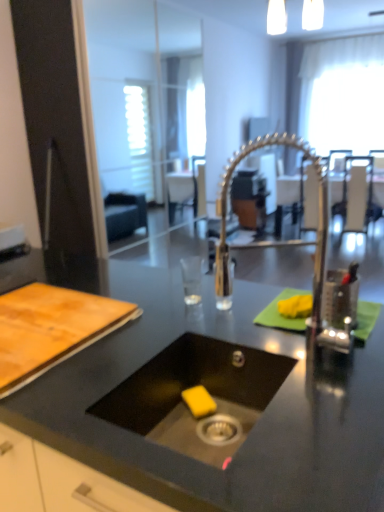
The width and height of the screenshot is (384, 512). What do you see at coordinates (253, 428) in the screenshot?
I see `black matte countertop at center` at bounding box center [253, 428].

Locate an element on the screen. The height and width of the screenshot is (512, 384). wooden cutting board at left is located at coordinates (51, 329).

What are the coordinates of `metallic silver chair at upper right, the 1th chair viewed from the right` in the screenshot? It's located at (357, 193).

The width and height of the screenshot is (384, 512). What do you see at coordinates (357, 193) in the screenshot?
I see `metallic silver chair at upper right, the 1th chair viewed from the right` at bounding box center [357, 193].

You are a GUI agent. You are given a task and a screenshot of the screen. Output one action in this format:
    pyautogui.click(x=<x>, y=<y>)
    Task: Click on the white sheer curtain at upper right
    The image size is (384, 512).
    Given the screenshot: What is the action you would take?
    pyautogui.click(x=343, y=94)

The image size is (384, 512). What are the coordinates of `black matte countertop at center` in the screenshot? It's located at (253, 428).

Which is correct: metallic silver chair at upper right, placed as the third chair when sorted from left to right, is inside wooden cutting board at left, or outside of it?

metallic silver chair at upper right, placed as the third chair when sorted from left to right, cannot be found inside wooden cutting board at left.

Are metallic silver chair at upper right, placed as the third chair when sorted from left to right, and wooden cutting board at left far apart?

No, metallic silver chair at upper right, placed as the third chair when sorted from left to right, is not far from wooden cutting board at left.

From a real-world perspective, is metallic silver chair at upper right, placed as the third chair when sorted from left to right, positioned above or below wooden cutting board at left?

Clearly, from a real-world perspective, metallic silver chair at upper right, placed as the third chair when sorted from left to right, is below wooden cutting board at left.

Are metallic silver table at center and black matte countertop at center located far from each other?

metallic silver table at center is positioned a significant distance from black matte countertop at center.

From the image's perspective, relative to black matte countertop at center, is metallic silver table at center above or below?

From the image's perspective, metallic silver table at center appears above black matte countertop at center.

Which is more to the right, metallic silver table at center or black matte countertop at center?

From the viewer's perspective, metallic silver table at center appears more on the right side.

How much distance is there between metallic silver table at center and black matte countertop at center?

The distance of metallic silver table at center from black matte countertop at center is 2.57 meters.

Would you say metallic silver chair at center, the third chair from the right, is inside or outside metallic silver chair at upper right, the 1th chair viewed from the right?

metallic silver chair at center, the third chair from the right, is spatially situated outside metallic silver chair at upper right, the 1th chair viewed from the right.

Which of these two, metallic silver chair at center, the third chair from the right, or metallic silver chair at upper right, the 1th chair viewed from the right, is wider?

metallic silver chair at upper right, the 1th chair viewed from the right, is wider.

Is metallic silver chair at center, arranged as the 1th chair when viewed from the left, far away from metallic silver chair at upper right, the 1th chair viewed from the right?

Indeed, metallic silver chair at center, arranged as the 1th chair when viewed from the left, is not near metallic silver chair at upper right, the 1th chair viewed from the right.

Does point (292, 212) come farther from viewer compared to point (302, 229)?

Yes, it is behind point (302, 229).

How much distance is there between metallic silver chair at center, arranged as the 1th chair when viewed from the left, and metallic silver chair at upper center, the 2th chair positioned from the right?

metallic silver chair at center, arranged as the 1th chair when viewed from the left, and metallic silver chair at upper center, the 2th chair positioned from the right, are 2.46 meters apart from each other.

Considering the relative sizes of metallic silver chair at center, arranged as the 1th chair when viewed from the left, and metallic silver chair at upper center, the 2th chair positioned from the right, in the image provided, is metallic silver chair at center, arranged as the 1th chair when viewed from the left, thinner than metallic silver chair at upper center, the 2th chair positioned from the right,?

Yes, metallic silver chair at center, arranged as the 1th chair when viewed from the left, is thinner than metallic silver chair at upper center, the 2th chair positioned from the right.

Which is more to the left, metallic silver chair at center, arranged as the 1th chair when viewed from the left, or metallic silver chair at upper center, the 2th chair positioned from the right?

Positioned to the left is metallic silver chair at center, arranged as the 1th chair when viewed from the left.

Does point (370, 181) appear closer or farther from the camera than point (283, 195)?

Clearly, point (370, 181) is closer to the camera than point (283, 195).

Is metallic silver chair at upper right, the 1th chair viewed from the right, taller than metallic silver chair at center, arranged as the 1th chair when viewed from the left?

Indeed, metallic silver chair at upper right, the 1th chair viewed from the right, has a greater height compared to metallic silver chair at center, arranged as the 1th chair when viewed from the left.

Which object is more forward, metallic silver chair at upper right, placed as the third chair when sorted from left to right, or metallic silver chair at center, the third chair from the right?

metallic silver chair at upper right, placed as the third chair when sorted from left to right, is in front.

Is black matte sink at center bigger or smaller than polished metallic faucet at center?

Considering their sizes, black matte sink at center takes up more space than polished metallic faucet at center.

What's the angular difference between black matte sink at center and polished metallic faucet at center's facing directions?

The angular difference between black matte sink at center and polished metallic faucet at center is 180 degrees.

Consider the image. Which of these two, black matte sink at center or polished metallic faucet at center, stands shorter?

With less height is black matte sink at center.

Can we say black matte sink at center lies outside polished metallic faucet at center?

Yes, black matte sink at center is located beyond the bounds of polished metallic faucet at center.

Considering the relative sizes of metallic silver table at center and wooden cutting board at left in the image provided, is metallic silver table at center wider than wooden cutting board at left?

Yes, metallic silver table at center is wider than wooden cutting board at left.

Is metallic silver table at center spatially inside wooden cutting board at left, or outside of it?

metallic silver table at center is spatially situated outside wooden cutting board at left.

In the image, is metallic silver table at center positioned in front of or behind wooden cutting board at left?

metallic silver table at center is behind wooden cutting board at left.

Who is shorter, metallic silver table at center or wooden cutting board at left?

Standing shorter between the two is wooden cutting board at left.

Identify the location of tray in front of the metallic silver chair at upper right, placed as the third chair when sorted from left to right. This screenshot has width=384, height=512. (51, 329).

Locate an element on the screen. table on the right of the black matte countertop at center is located at coordinates (288, 190).

Based on their spatial positions, is white sheer curtain at upper right or metallic silver table at center further from metallic silver chair at upper right, placed as the third chair when sorted from left to right?

Among the two, white sheer curtain at upper right is located further to metallic silver chair at upper right, placed as the third chair when sorted from left to right.

Based on the photo, looking at the image, which one is located further to metallic silver chair at upper center, the 2th chair positioned from the right, polished metallic faucet at center or black matte sink at center?

black matte sink at center is further to metallic silver chair at upper center, the 2th chair positioned from the right.

Based on their spatial positions, is metallic silver chair at upper center, which is counted as the second chair, starting from the left, or metallic silver chair at upper right, placed as the third chair when sorted from left to right, closer to black matte countertop at center?

Among the two, metallic silver chair at upper center, which is counted as the second chair, starting from the left, is located nearer to black matte countertop at center.

Estimate the real-world distances between objects in this image. Which object is closer to polished metallic faucet at center, metallic silver chair at center, the third chair from the right, or metallic silver table at center?

metallic silver chair at center, the third chair from the right, is closer to polished metallic faucet at center.

Considering their positions, is metallic silver chair at center, the third chair from the right, positioned closer to metallic silver chair at upper center, the 2th chair positioned from the right, than polished metallic faucet at center?

Based on the image, polished metallic faucet at center appears to be nearer to metallic silver chair at upper center, the 2th chair positioned from the right.

Which object lies nearer to the anchor point metallic silver chair at center, arranged as the 1th chair when viewed from the left, metallic silver chair at upper center, the 2th chair positioned from the right, or black matte countertop at center?

Among the two, black matte countertop at center is located nearer to metallic silver chair at center, arranged as the 1th chair when viewed from the left.

From the picture: Looking at the image, which one is located further to metallic silver chair at upper center, which is counted as the second chair, starting from the left, metallic silver chair at upper right, the 1th chair viewed from the right, or black matte sink at center?

Among the two, black matte sink at center is located further to metallic silver chair at upper center, which is counted as the second chair, starting from the left.

Considering their positions, is metallic silver chair at upper right, placed as the third chair when sorted from left to right, positioned closer to metallic silver chair at upper center, which is counted as the second chair, starting from the left, than white sheer curtain at upper right?

metallic silver chair at upper right, placed as the third chair when sorted from left to right, lies closer to metallic silver chair at upper center, which is counted as the second chair, starting from the left, than the other object.

Identify the location of table positioned between black matte sink at center and metallic silver chair at upper center, which is counted as the second chair, starting from the left, from near to far. The height and width of the screenshot is (512, 384). (288, 190).

I want to click on sink between polished metallic faucet at center and black matte countertop at center vertically, so click(x=190, y=386).

The height and width of the screenshot is (512, 384). I want to click on faucet located between black matte countertop at center and metallic silver chair at center, the third chair from the right, in the depth direction, so click(284, 242).

Locate an element on the screen. faucet between black matte countertop at center and white sheer curtain at upper right along the z-axis is located at coordinates point(284,242).